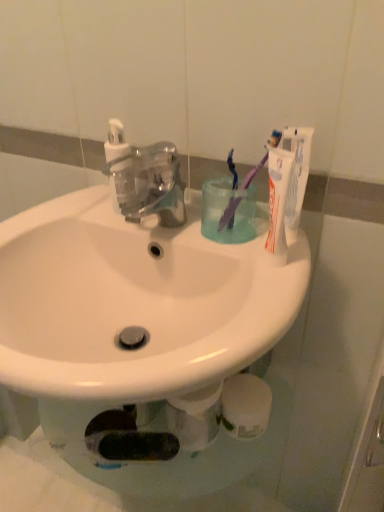
Where is `vacant region to the left of transparent plastic faucet at center`? Image resolution: width=384 pixels, height=512 pixels. vacant region to the left of transparent plastic faucet at center is located at coordinates (75, 217).